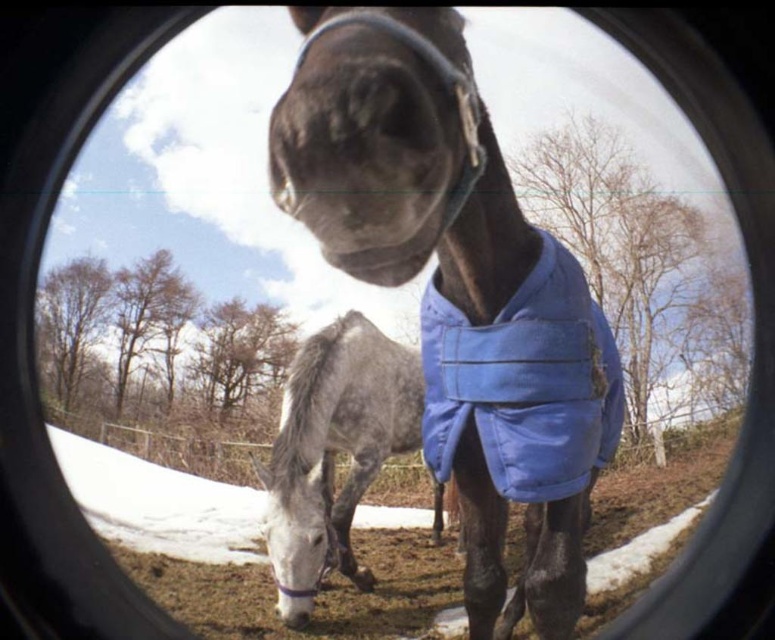
How far apart are shiny blue blanket at center and gray speckled coat at center?

The distance of shiny blue blanket at center from gray speckled coat at center is 6.51 feet.

Looking at this image, is the position of shiny blue blanket at center more distant than that of gray speckled coat at center?

That is False.

This screenshot has width=775, height=640. What are the coordinates of `shiny blue blanket at center` in the screenshot? It's located at (457, 292).

Does blue fabric at center have a lesser width compared to gray speckled coat at center?

Yes.

Is blue fabric at center above gray speckled coat at center?

Yes, blue fabric at center is above gray speckled coat at center.

This screenshot has width=775, height=640. Find the location of `blue fabric at center`. blue fabric at center is located at coordinates (524, 381).

Is shiny blue blanket at center above blue fabric at center?

Indeed, shiny blue blanket at center is positioned over blue fabric at center.

Can you confirm if shiny blue blanket at center is shorter than blue fabric at center?

In fact, shiny blue blanket at center may be taller than blue fabric at center.

Where is `shiny blue blanket at center`? shiny blue blanket at center is located at coordinates pyautogui.click(x=457, y=292).